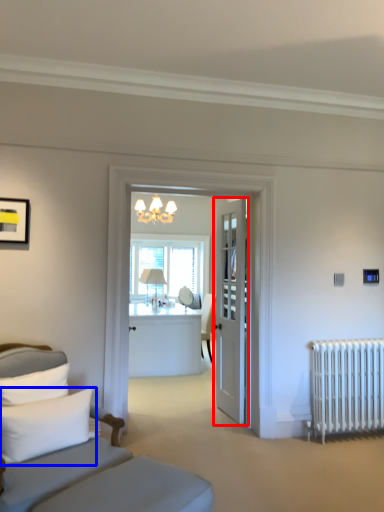
Question: Among these objects, which one is nearest to the camera, door (highlighted by a red box) or pillow (highlighted by a blue box)?

Choices:
 (A) door
 (B) pillow

Answer: (B)